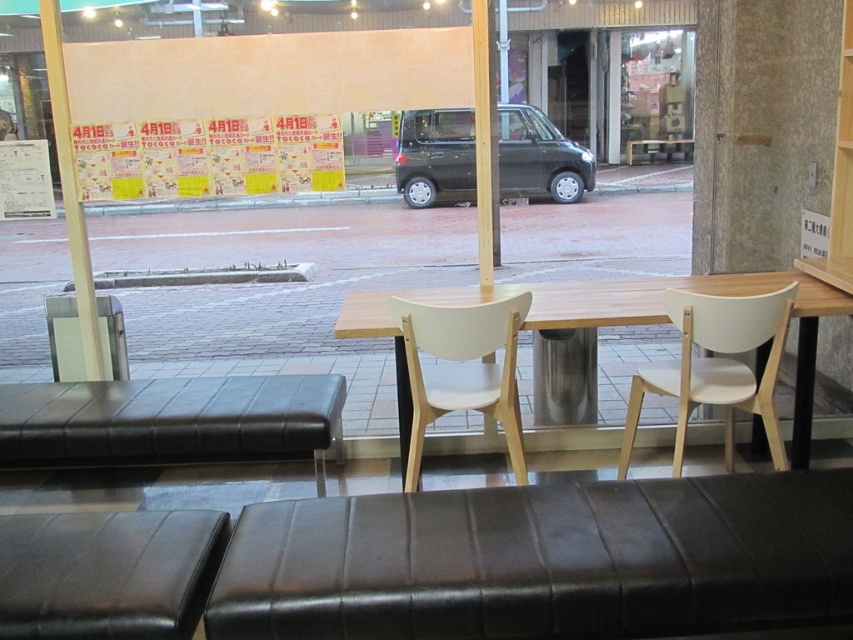
In the scene shown: You are a delivery person trying to place a large package between the white wood chair at right and the black leather hassock at center. Based on the scene, can the package fit between them if it requires at least 1.2 meters of space?

The white wood chair at right has a lesser width compared to the black leather hassock at center. Since the package requires at least 1.2 meters of space, but the exact width between them isn

You are a customer entering the seating area and want to sit comfortably. You see the white wood chair at right and the black leather hassock at center. Which one is taller and would be better for your height?

The black leather hassock at center is taller than the white wood chair at right, so it would be better for your height.